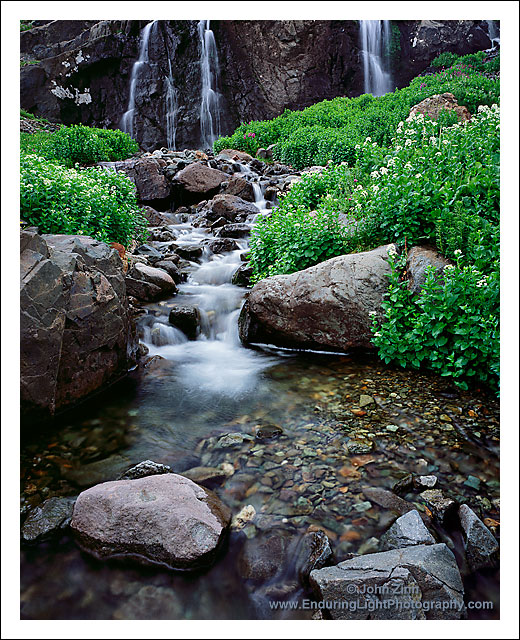
Identify the location of green plants. (343, 125), (66, 217), (91, 136), (484, 354).